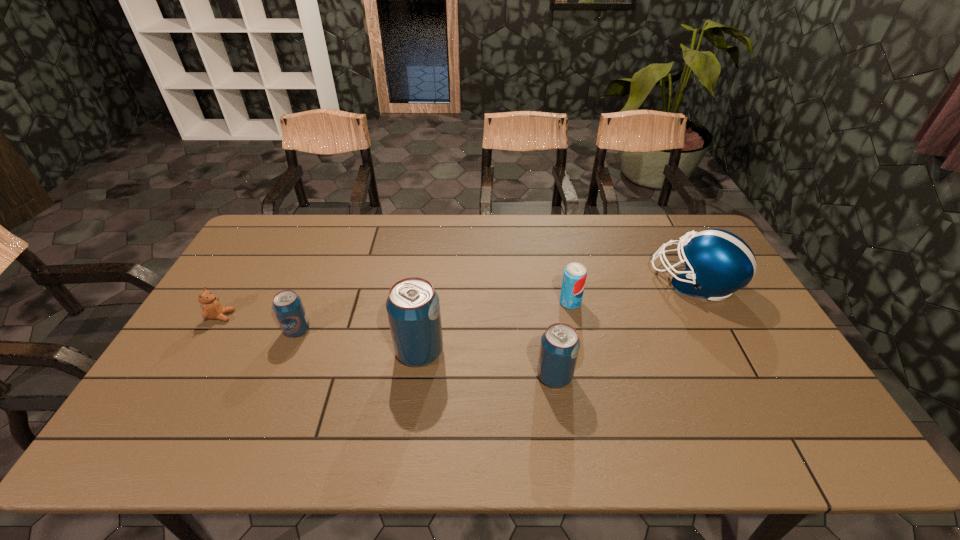
Please point a vacant point for placing a pop soda on the right. Please provide its 2D coordinates. Your answer should be formatted as a tuple, i.e. [(x, y)], where the tuple contains the x and y coordinates of a point satisfying the conditions above.

[(704, 403)]